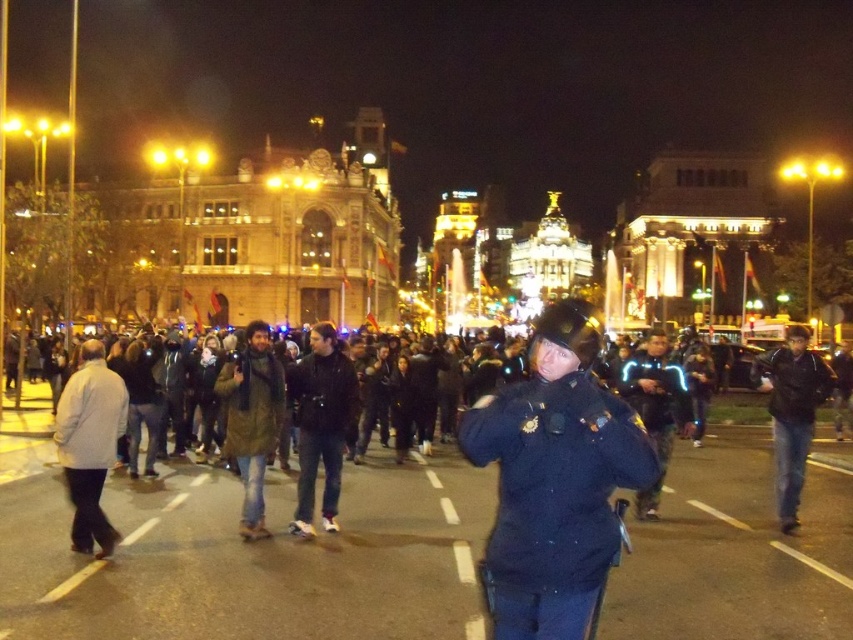
At what (x,y) coordinates should I click in order to perform the action: click on green textured coat at center. Please return your answer as a coordinate pair (x, y). This screenshot has height=640, width=853. Looking at the image, I should click on (251, 419).

Is green textured coat at center smaller than black reflective jacket at center?

Correct, green textured coat at center occupies less space than black reflective jacket at center.

Is point (276, 403) in front of point (654, 346)?

Yes, point (276, 403) is in front of point (654, 346).

At what (x,y) coordinates should I click in order to perform the action: click on green textured coat at center. Please return your answer as a coordinate pair (x, y). The height and width of the screenshot is (640, 853). Looking at the image, I should click on (251, 419).

Is point (502, 477) positioned in front of point (339, 424)?

Yes, point (502, 477) is closer to viewer.

Is black uniformed officer at center thinner than black leather jacket at center?

No.

Is point (548, 616) positioned after point (343, 374)?

That is False.

The height and width of the screenshot is (640, 853). I want to click on black uniformed officer at center, so click(x=554, y=481).

Between point (601, 403) and point (256, 426), which one is positioned in front?

Point (601, 403) is in front.

Consider the image. Can you confirm if black uniformed officer at center is positioned above green textured coat at center?

No, black uniformed officer at center is not above green textured coat at center.

Identify the location of black uniformed officer at center. The width and height of the screenshot is (853, 640). (554, 481).